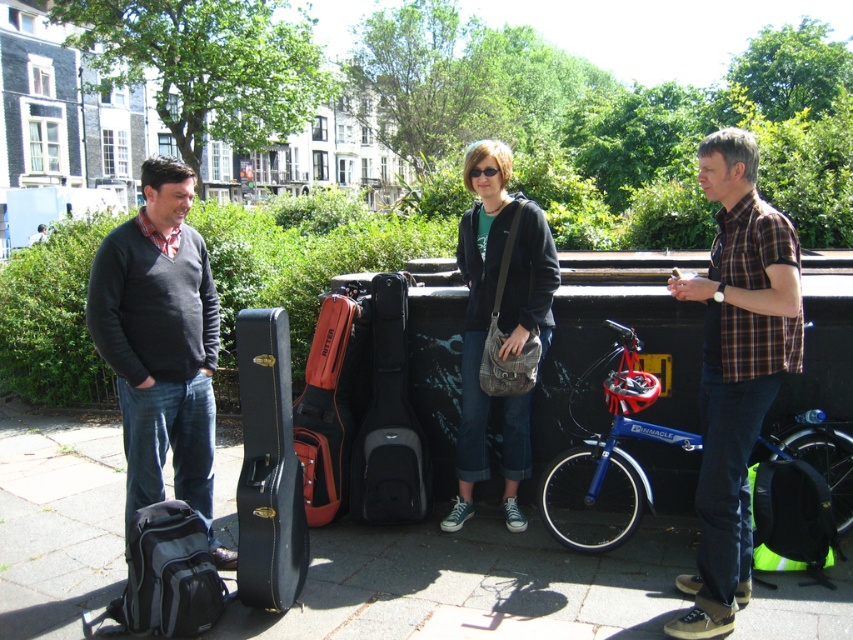
You are a photographer trying to capture a photo of the denim pants at center and the black matte guitar case at center. Which object would appear larger in your photo?

The denim pants at center would appear larger in the photo because it is closer to the viewer than the black matte guitar case at center.

You are a delivery person who needs to park your blue metallic bicycle at right and place your black leather guitar case at center near the wall. Which object should you place closer to the wall?

The black leather guitar case at center is closer to the wall than the blue metallic bicycle at right, so you should place the black leather guitar case at center near the wall first.

You are a photographer setting up a tripod in this outdoor scene. You need to position it so that it doesn t block the view of the brown plaid shirt at right and the black matte guitar case at center. Based on their positions, which object is wider and might require more space between them?

The brown plaid shirt at right might be wider than the black matte guitar case at center, so it requires more space between them to avoid blocking the view.